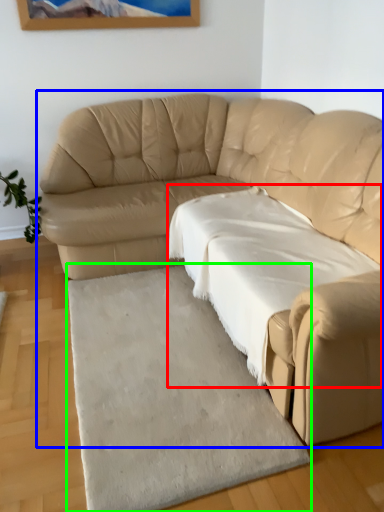
Question: Which object is positioned closest to sheet (highlighted by a red box)? Select from studio couch (highlighted by a blue box) and mat (highlighted by a green box).

Choices:
 (A) studio couch
 (B) mat

Answer: (A)